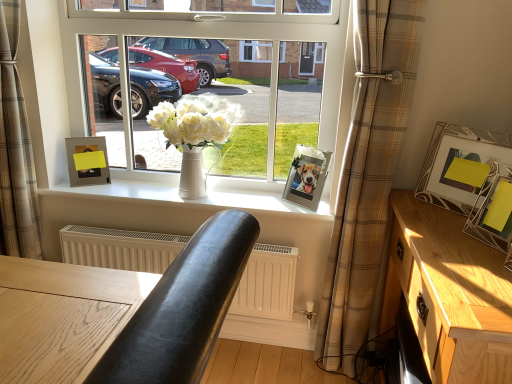
Image resolution: width=512 pixels, height=384 pixels. What are the coordinates of `empty space that is ontop of light wood/dark finish cabinet at right, positioned as the first table in right-to-left order (from a real-world perspective)` in the screenshot? It's located at (456, 244).